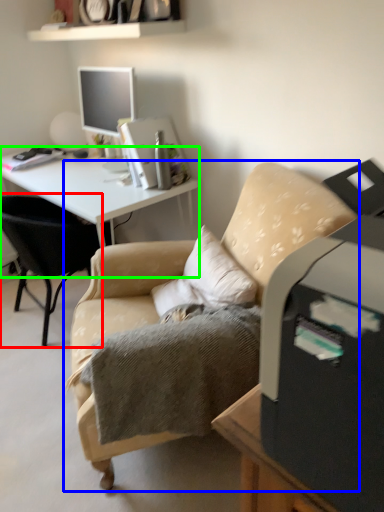
Question: Which is nearer to the chair (highlighted by a red box)? chair (highlighted by a blue box) or desk (highlighted by a green box).

Choices:
 (A) chair
 (B) desk

Answer: (B)